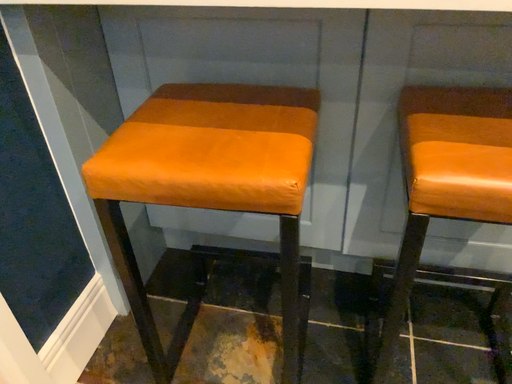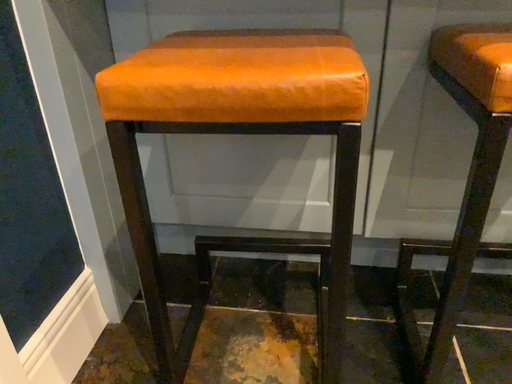
Question: Which way did the camera rotate in the video?

Choices:
 (A) rotated upward
 (B) rotated downward

Answer: (A)